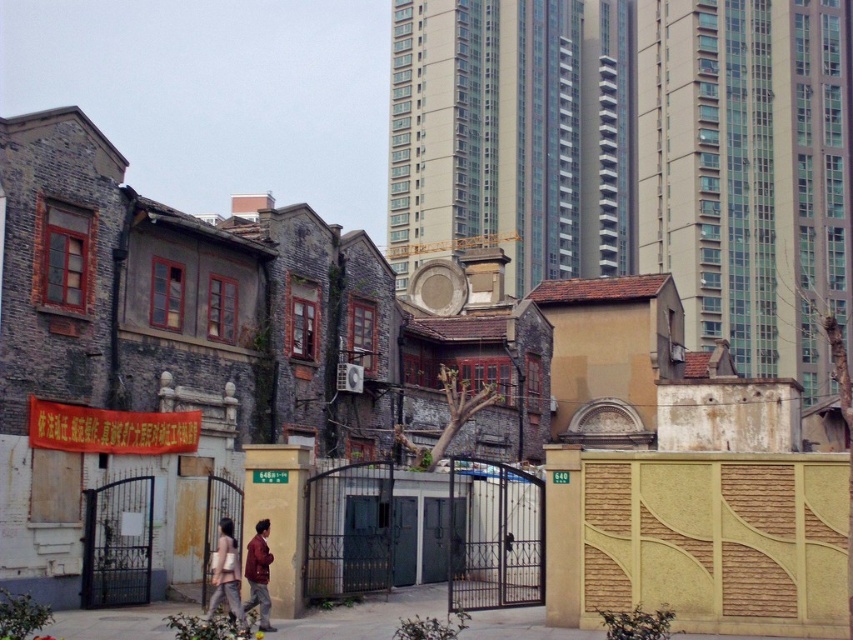
Question: Which point is closer to the camera taking this photo?

Choices:
 (A) (250, 579)
 (B) (215, 566)

Answer: (B)

Question: Is light brown leather jacket at center below maroon fabric jacket at center?

Choices:
 (A) yes
 (B) no

Answer: (B)

Question: Is light brown leather jacket at center below maroon fabric jacket at center?

Choices:
 (A) yes
 (B) no

Answer: (B)

Question: Which point appears closest to the camera in this image?

Choices:
 (A) (219, 566)
 (B) (264, 532)

Answer: (A)

Question: Observing the image, what is the correct spatial positioning of light brown leather jacket at center in reference to maroon fabric jacket at center?

Choices:
 (A) left
 (B) right

Answer: (A)

Question: Which point is farther from the camera taking this photo?

Choices:
 (A) (218, 540)
 (B) (267, 577)

Answer: (A)